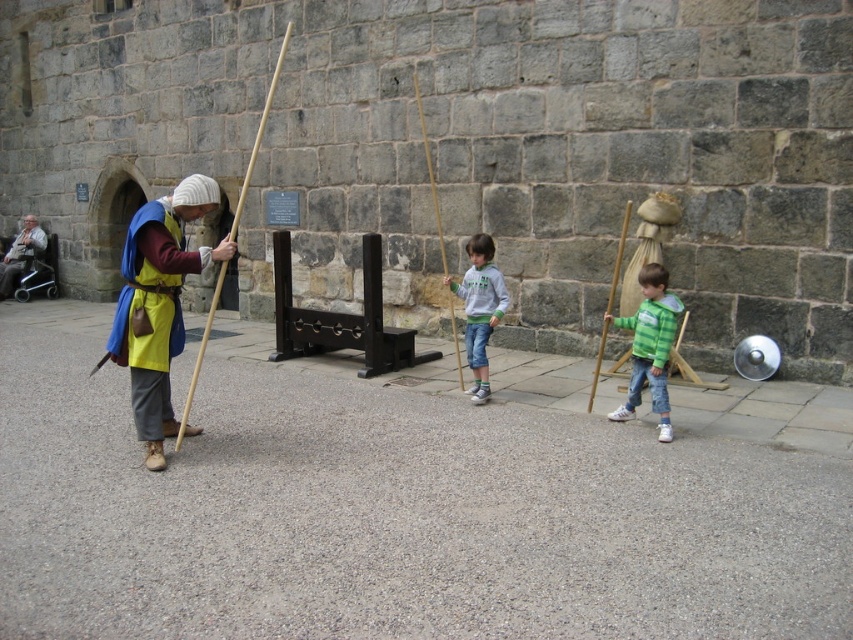
Who is lower down, brown wooden stick at center or wooden stick at right?

wooden stick at right

Which is in front, point (431, 161) or point (624, 211)?

Point (624, 211) is in front.

Is point (416, 108) less distant than point (607, 323)?

No, it is behind (607, 323).

This screenshot has height=640, width=853. I want to click on brown wooden stick at center, so click(x=430, y=177).

Where is `wooden staff at left`? This screenshot has width=853, height=640. wooden staff at left is located at coordinates click(160, 304).

Between wooden staff at left and wooden stick at right, which one has more height?

Answer: With more height is wooden stick at right.

Does point (154, 218) come in front of point (604, 326)?

That is True.

You are a GUI agent. You are given a task and a screenshot of the screen. Output one action in this format:
    pyautogui.click(x=<x>, y=<y>)
    Task: Click on the wooden staff at left
    Image resolution: width=853 pixels, height=640 pixels.
    Given the screenshot: What is the action you would take?
    pyautogui.click(x=160, y=304)

Who is more forward, (495, 275) or (33, 228)?

Positioned in front is point (495, 275).

Does gray fleece sweater at center appear under light brown leather jacket at left?

Yes, gray fleece sweater at center is below light brown leather jacket at left.

Does point (485, 276) lie behind point (15, 269)?

No, it is in front of (15, 269).

Identify the location of gray fleece sweater at center. (479, 308).